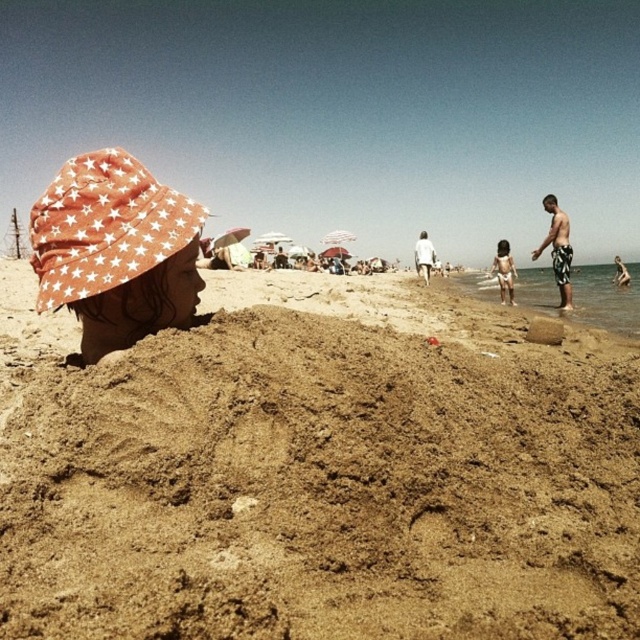
Question: Which of the following is the closest to the observer?

Choices:
 (A) light gray fabric shorts at center
 (B) brown sandy mound at lower center

Answer: (B)

Question: Observing the image, what is the correct spatial positioning of brown sandy mound at lower center in reference to white skin child at lower center?

Choices:
 (A) above
 (B) below

Answer: (B)

Question: Is brown sandy mound at lower center wider than black and white striped shorts at right?

Choices:
 (A) yes
 (B) no

Answer: (B)

Question: Which point is closer to the camera taking this photo?

Choices:
 (A) (552, 257)
 (B) (419, 244)
 (C) (596, 630)
 (D) (496, 275)

Answer: (C)

Question: Considering the relative positions of white skin child at lower center and light gray fabric shorts at center in the image provided, where is white skin child at lower center located with respect to light gray fabric shorts at center?

Choices:
 (A) above
 (B) below

Answer: (B)

Question: Which of the following is the closest to the observer?

Choices:
 (A) white skin child at lower center
 (B) brown sandy mound at lower center
 (C) light gray fabric shorts at center

Answer: (B)